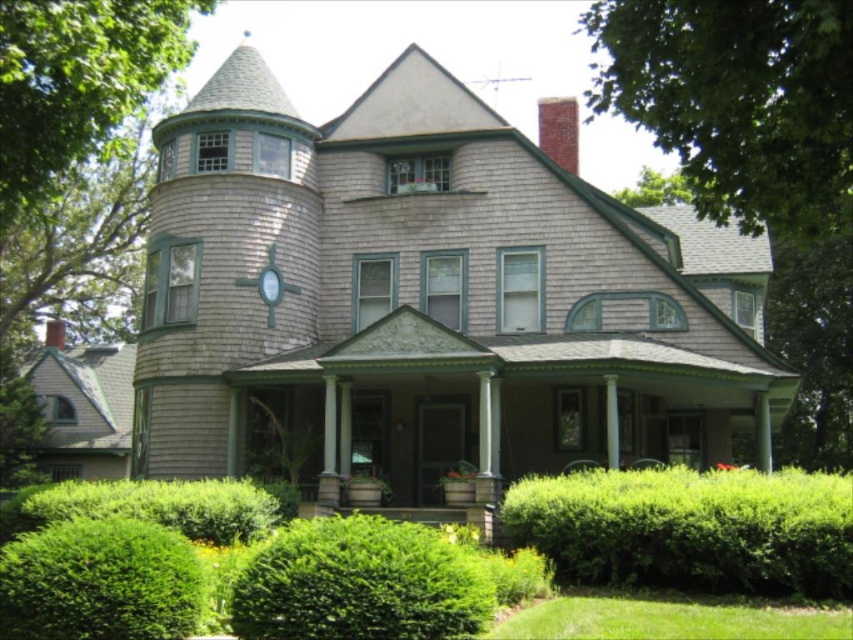
Which is more to the right, green leafy tree at upper right or green leafy hedge at lower right?

green leafy tree at upper right

Between green leafy tree at upper right and green leafy hedge at lower right, which one appears on the left side from the viewer's perspective?

green leafy hedge at lower right is more to the left.

Is point (747, 164) closer to viewer compared to point (683, 497)?

Yes.

Find the location of `green leafy tree at upper right`. green leafy tree at upper right is located at coordinates (737, 100).

Does green leafy hedge at lower left have a greater height compared to green leafy tree at upper left?

In fact, green leafy hedge at lower left may be shorter than green leafy tree at upper left.

The image size is (853, 640). I want to click on green leafy hedge at lower left, so click(x=99, y=582).

Can you confirm if green leafy hedge at lower left is smaller than green grass at lower right?

No, green leafy hedge at lower left is not smaller than green grass at lower right.

You are a GUI agent. You are given a task and a screenshot of the screen. Output one action in this format:
    pyautogui.click(x=<x>, y=<y>)
    Task: Click on the green leafy hedge at lower left
    This screenshot has width=853, height=640.
    Given the screenshot: What is the action you would take?
    pyautogui.click(x=99, y=582)